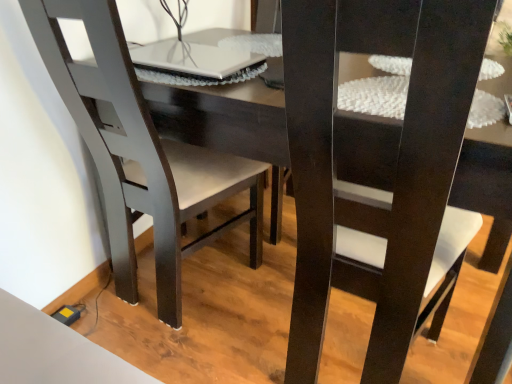
This screenshot has width=512, height=384. What do you see at coordinates (140, 153) in the screenshot?
I see `matte black chair at left, the first chair when ordered from left to right` at bounding box center [140, 153].

Locate an element on the screen. This screenshot has height=384, width=512. matte black chair at center, which is counted as the 1th chair, starting from the right is located at coordinates (378, 189).

Identify the location of white glossy laptop at upper center. The width and height of the screenshot is (512, 384). (197, 61).

Is the position of matte black chair at center, the 2th chair positioned from the left, more distant than that of matte black chair at left, the first chair when ordered from left to right?

No, matte black chair at center, the 2th chair positioned from the left, is closer to the camera.

Is matte black chair at center, the 2th chair positioned from the left, next to matte black chair at left, which is the 2th chair from right to left?

There is a gap between matte black chair at center, the 2th chair positioned from the left, and matte black chair at left, which is the 2th chair from right to left.

Between matte black chair at center, the 2th chair positioned from the left, and matte black chair at left, the first chair when ordered from left to right, which one has larger width?

With larger width is matte black chair at center, the 2th chair positioned from the left.

Do you think matte black chair at center, which is counted as the 1th chair, starting from the right, is within white glossy laptop at upper center, or outside of it?

matte black chair at center, which is counted as the 1th chair, starting from the right, is outside white glossy laptop at upper center.

Considering the relative sizes of matte black chair at center, the 2th chair positioned from the left, and white glossy laptop at upper center in the image provided, is matte black chair at center, the 2th chair positioned from the left, thinner than white glossy laptop at upper center?

No.

From a real-world perspective, is matte black chair at center, which is counted as the 1th chair, starting from the right, on white glossy laptop at upper center?

No, from a real-world perspective, matte black chair at center, which is counted as the 1th chair, starting from the right, is not above white glossy laptop at upper center.

There is a white glossy laptop at upper center. Where is `the 2nd chair below it (from a real-world perspective)`? The image size is (512, 384). the 2nd chair below it (from a real-world perspective) is located at coordinates (140, 153).

From the image's perspective, is white glossy laptop at upper center located beneath matte black chair at left, which is the 2th chair from right to left?

No, from the image's perspective, white glossy laptop at upper center is not beneath matte black chair at left, which is the 2th chair from right to left.

From a real-world perspective, who is located lower, white glossy laptop at upper center or matte black chair at left, which is the 2th chair from right to left?

matte black chair at left, which is the 2th chair from right to left, from a real-world perspective.

Can you tell me how much white glossy laptop at upper center and matte black chair at left, the first chair when ordered from left to right, differ in facing direction?

The angle between the facing direction of white glossy laptop at upper center and the facing direction of matte black chair at left, the first chair when ordered from left to right, is 180 degrees.

Which object is closer to the camera taking this photo, matte black chair at left, which is the 2th chair from right to left, or matte black chair at center, which is counted as the 1th chair, starting from the right?

matte black chair at center, which is counted as the 1th chair, starting from the right.

Considering the sizes of matte black chair at left, the first chair when ordered from left to right, and matte black chair at center, the 2th chair positioned from the left, in the image, is matte black chair at left, the first chair when ordered from left to right, taller or shorter than matte black chair at center, the 2th chair positioned from the left,?

Clearly, matte black chair at left, the first chair when ordered from left to right, is shorter compared to matte black chair at center, the 2th chair positioned from the left.

From the image's perspective, is matte black chair at left, the first chair when ordered from left to right, beneath matte black chair at center, which is counted as the 1th chair, starting from the right?

No, from the image's perspective, matte black chair at left, the first chair when ordered from left to right, is not beneath matte black chair at center, which is counted as the 1th chair, starting from the right.

Is matte black chair at left, the first chair when ordered from left to right, in contact with matte black chair at center, the 2th chair positioned from the left?

No, matte black chair at left, the first chair when ordered from left to right, is not with matte black chair at center, the 2th chair positioned from the left.

Can you tell me how much white glossy laptop at upper center and matte black chair at center, the 2th chair positioned from the left, differ in facing direction?

There is a 179-degree angle between the facing directions of white glossy laptop at upper center and matte black chair at center, the 2th chair positioned from the left.

In the image, is white glossy laptop at upper center positioned in front of or behind matte black chair at center, which is counted as the 1th chair, starting from the right?

Clearly, white glossy laptop at upper center is behind matte black chair at center, which is counted as the 1th chair, starting from the right.

Is white glossy laptop at upper center far away from matte black chair at center, the 2th chair positioned from the left?

Actually, white glossy laptop at upper center and matte black chair at center, the 2th chair positioned from the left, are a little close together.

Find the location of a particular element. chair that is the 1st one when counting forward from the white glossy laptop at upper center is located at coordinates (140, 153).

Which of these two, matte black chair at left, the first chair when ordered from left to right, or white glossy laptop at upper center, stands shorter?

white glossy laptop at upper center is shorter.

Which of these two, matte black chair at left, the first chair when ordered from left to right, or white glossy laptop at upper center, is wider?

With larger width is matte black chair at left, the first chair when ordered from left to right.

Based on their positions, is matte black chair at left, the first chair when ordered from left to right, located to the left or right of white glossy laptop at upper center?

Clearly, matte black chair at left, the first chair when ordered from left to right, is on the left of white glossy laptop at upper center in the image.

Locate an element on the screen. This screenshot has height=384, width=512. chair below the matte black chair at left, the first chair when ordered from left to right (from the image's perspective) is located at coordinates (378, 189).

At what (x,y) coordinates should I click in order to perform the action: click on laptop behind the matte black chair at center, which is counted as the 1th chair, starting from the right. Please return your answer as a coordinate pair (x, y). Image resolution: width=512 pixels, height=384 pixels. Looking at the image, I should click on pyautogui.click(x=197, y=61).

From the image, which object appears to be farther from matte black chair at center, the 2th chair positioned from the left, white glossy laptop at upper center or matte black chair at left, which is the 2th chair from right to left?

white glossy laptop at upper center is further to matte black chair at center, the 2th chair positioned from the left.

Estimate the real-world distances between objects in this image. Which object is closer to matte black chair at left, the first chair when ordered from left to right, matte black chair at center, which is counted as the 1th chair, starting from the right, or white glossy laptop at upper center?

white glossy laptop at upper center is closer to matte black chair at left, the first chair when ordered from left to right.

From the image, which object appears to be farther from white glossy laptop at upper center, matte black chair at left, which is the 2th chair from right to left, or matte black chair at center, the 2th chair positioned from the left?

matte black chair at center, the 2th chair positioned from the left, lies further to white glossy laptop at upper center than the other object.

Estimate the real-world distances between objects in this image. Which object is further from white glossy laptop at upper center, matte black chair at center, which is counted as the 1th chair, starting from the right, or matte black chair at left, the first chair when ordered from left to right?

The object further to white glossy laptop at upper center is matte black chair at center, which is counted as the 1th chair, starting from the right.

Which object lies further to the anchor point matte black chair at center, which is counted as the 1th chair, starting from the right, matte black chair at left, the first chair when ordered from left to right, or white glossy laptop at upper center?

Based on the image, white glossy laptop at upper center appears to be further to matte black chair at center, which is counted as the 1th chair, starting from the right.

When comparing their distances from matte black chair at left, which is the 2th chair from right to left, does white glossy laptop at upper center or matte black chair at center, the 2th chair positioned from the left, seem further?

matte black chair at center, the 2th chair positioned from the left, is positioned further to the anchor matte black chair at left, which is the 2th chair from right to left.

Identify the location of laptop between matte black chair at left, the first chair when ordered from left to right, and matte black chair at center, which is counted as the 1th chair, starting from the right, from left to right. This screenshot has height=384, width=512. (197, 61).